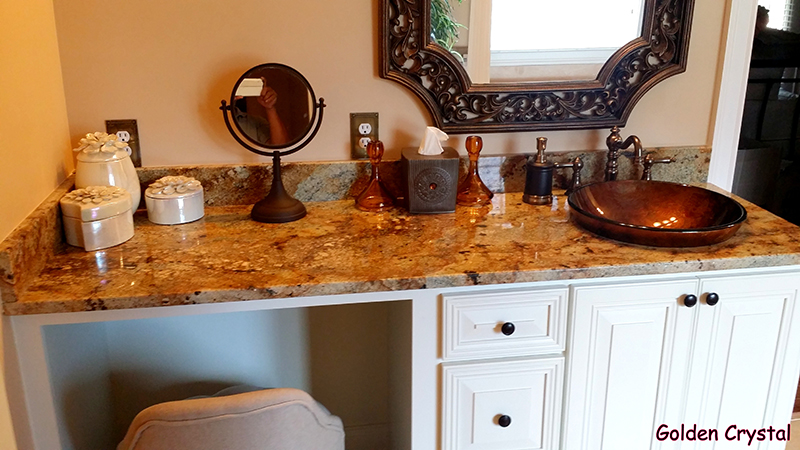
This screenshot has height=450, width=800. I want to click on mirror, so click(x=290, y=121).